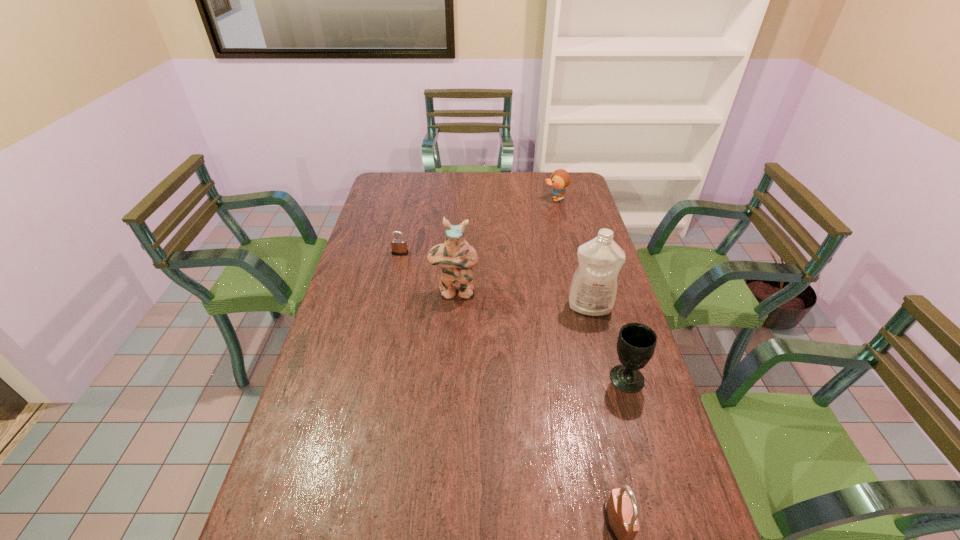
Where is `the shortest object`? The image size is (960, 540). the shortest object is located at coordinates (399, 246).

Where is `the shorter padlock`? the shorter padlock is located at coordinates (399, 246).

Image resolution: width=960 pixels, height=540 pixels. I want to click on duck, so click(560, 179).

The width and height of the screenshot is (960, 540). What are the coordinates of `the fifth farthest object` in the screenshot? It's located at coord(636,343).

Locate an element on the screen. Image resolution: width=960 pixels, height=540 pixels. detergent is located at coordinates (593, 289).

Find the location of a particular element. The height and width of the screenshot is (540, 960). the fifth object from right to left is located at coordinates (456, 257).

Identify the location of blank space located on the right of the farther padlock. Image resolution: width=960 pixels, height=540 pixels. (460, 253).

At what (x,y) coordinates should I click in order to perform the action: click on vacant point located on the front-facing side of the duck. Please return your answer as a coordinate pair (x, y). The image size is (960, 540). Looking at the image, I should click on (476, 199).

Where is `vacant space located 0.070m on the front-facing side of the duck`? The image size is (960, 540). vacant space located 0.070m on the front-facing side of the duck is located at coordinates (527, 199).

In order to click on free location located 0.370m on the front-facing side of the duck in this screenshot , I will do [458, 199].